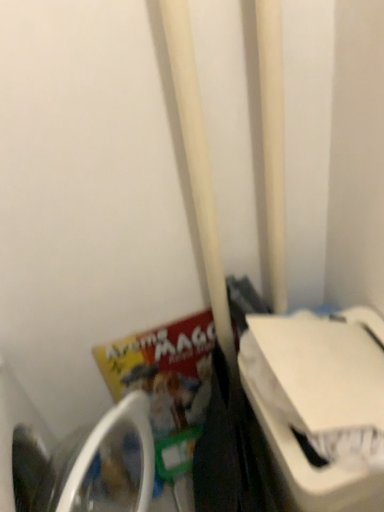
Question: From the image's perspective, would you say white plastic washing machine at lower left, arranged as the second washing machine when viewed from the right, is positioned over white plastic washing machine at right, which ranks as the 1th washing machine in right-to-left order?

Choices:
 (A) no
 (B) yes

Answer: (A)

Question: Is white plastic washing machine at right, which ranks as the 1th washing machine in right-to-left order, a part of white plastic washing machine at lower left, which appears as the 1th washing machine when viewed from the left?

Choices:
 (A) no
 (B) yes

Answer: (A)

Question: Does white plastic washing machine at lower left, arranged as the second washing machine when viewed from the right, have a lesser width compared to white plastic washing machine at right, which ranks as the 1th washing machine in right-to-left order?

Choices:
 (A) yes
 (B) no

Answer: (B)

Question: From a real-world perspective, is white plastic washing machine at lower left, arranged as the second washing machine when viewed from the right, on white plastic washing machine at right, arranged as the second washing machine when viewed from the left?

Choices:
 (A) no
 (B) yes

Answer: (B)

Question: Is white plastic washing machine at lower left, arranged as the second washing machine when viewed from the right, next to white plastic washing machine at right, arranged as the second washing machine when viewed from the left, and touching it?

Choices:
 (A) no
 (B) yes

Answer: (A)

Question: Based on their positions, is white matte pole at center located to the left or right of matte paper book at lower left?

Choices:
 (A) right
 (B) left

Answer: (A)

Question: Considering the positions of point (276, 142) and point (137, 384), is point (276, 142) closer or farther from the camera than point (137, 384)?

Choices:
 (A) farther
 (B) closer

Answer: (B)

Question: Is white matte pole at center bigger or smaller than matte paper book at lower left?

Choices:
 (A) big
 (B) small

Answer: (B)

Question: Which is correct: white matte pole at center is inside matte paper book at lower left, or outside of it?

Choices:
 (A) inside
 (B) outside

Answer: (B)

Question: Relative to white matte pole at center, is white plastic washing machine at right, which ranks as the 1th washing machine in right-to-left order, in front or behind?

Choices:
 (A) behind
 (B) front

Answer: (B)

Question: From their relative heights in the image, would you say white plastic washing machine at right, which ranks as the 1th washing machine in right-to-left order, is taller or shorter than white matte pole at center?

Choices:
 (A) tall
 (B) short

Answer: (B)

Question: Looking at their shapes, would you say white plastic washing machine at right, which ranks as the 1th washing machine in right-to-left order, is wider or thinner than white matte pole at center?

Choices:
 (A) thin
 (B) wide

Answer: (B)

Question: Based on their sizes in the image, would you say white plastic washing machine at right, arranged as the second washing machine when viewed from the left, is bigger or smaller than white matte pole at center?

Choices:
 (A) big
 (B) small

Answer: (A)

Question: Based on their positions, is white matte pole at center located to the left or right of white plastic washing machine at right, arranged as the second washing machine when viewed from the left?

Choices:
 (A) left
 (B) right

Answer: (A)

Question: Considering the positions of white matte pole at center and white plastic washing machine at right, which ranks as the 1th washing machine in right-to-left order, in the image, is white matte pole at center wider or thinner than white plastic washing machine at right, which ranks as the 1th washing machine in right-to-left order,?

Choices:
 (A) thin
 (B) wide

Answer: (A)